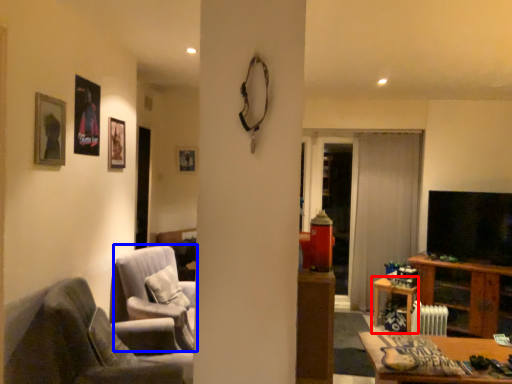
Question: Which object appears closest to the camera in this image, table (highlighted by a red box) or chair (highlighted by a blue box)?

Choices:
 (A) table
 (B) chair

Answer: (B)